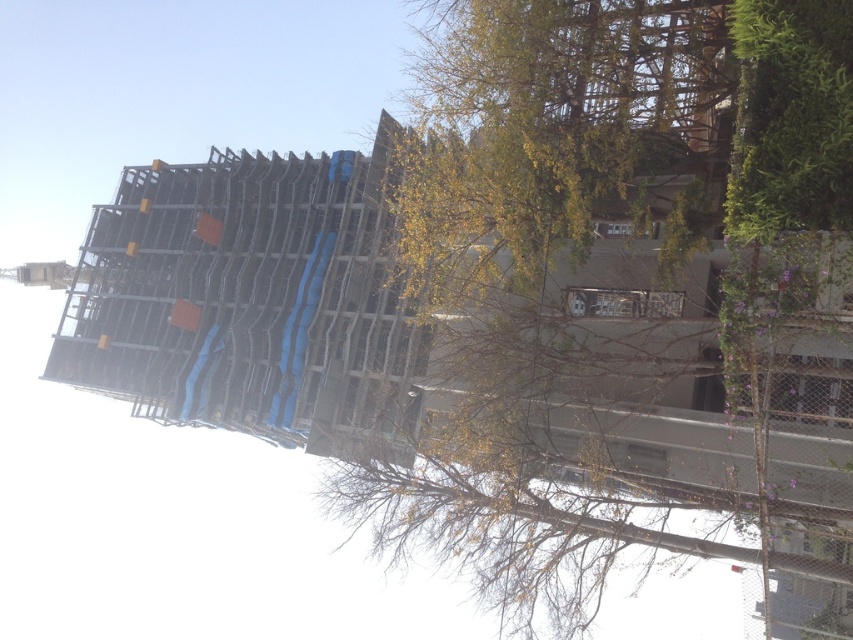
Consider the image. Is green leafy tree at upper center thinner than metal chain-link fence at right?

No, green leafy tree at upper center is not thinner than metal chain-link fence at right.

Can you confirm if green leafy tree at upper center is positioned below metal chain-link fence at right?

Actually, green leafy tree at upper center is above metal chain-link fence at right.

This screenshot has height=640, width=853. What are the coordinates of `green leafy tree at upper center` in the screenshot? It's located at (624, 300).